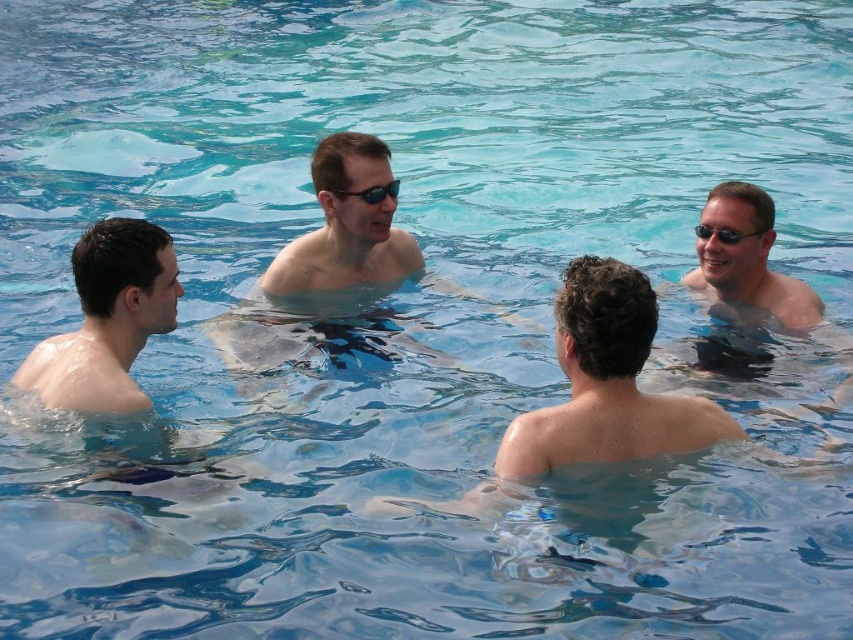
You are a lifeguard standing at the edge of the pool. You notice two points in the water labeled point (x=126, y=396) and point (x=723, y=236). Which point is closer to you?

Point (x=126, y=396) is closer to the viewer than point (x=723, y=236).